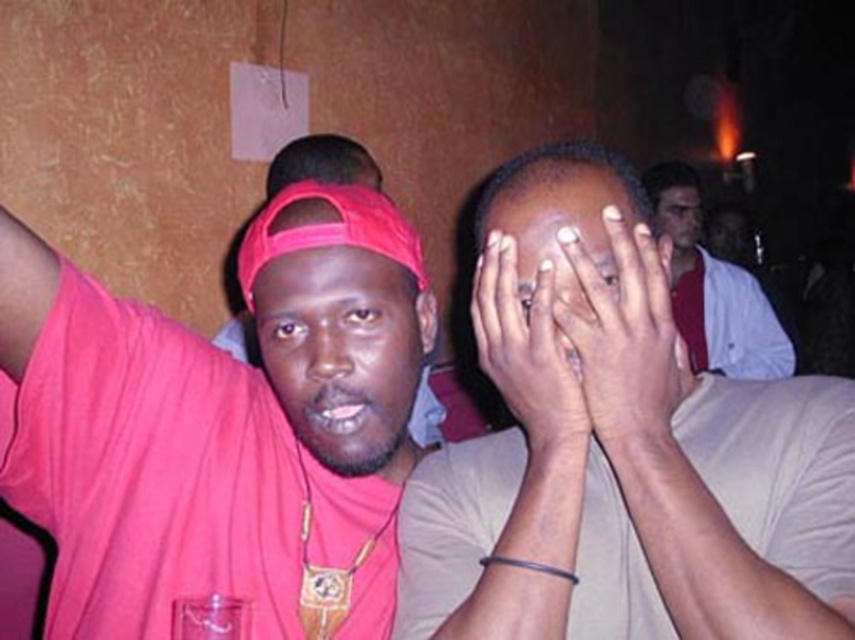
Who is more forward, (567,342) or (669,221)?

Point (567,342)

Is point (570, 422) more distant than point (671, 237)?

No, (570, 422) is closer to viewer.

Between point (555, 420) and point (677, 244), which one is positioned in front?

Point (555, 420) is in front.

You are a GUI agent. You are given a task and a screenshot of the screen. Output one action in this format:
    pyautogui.click(x=<x>, y=<y>)
    Task: Click on the silver metallic ring at center
    This screenshot has height=640, width=855.
    Given the screenshot: What is the action you would take?
    pyautogui.click(x=525, y=348)

Is white matte ring at center wider than smooth skin at center?

Indeed, white matte ring at center has a greater width compared to smooth skin at center.

Who is taller, white matte ring at center or smooth skin at center?

Standing taller between the two is white matte ring at center.

Image resolution: width=855 pixels, height=640 pixels. Find the location of `white matte ring at center`. white matte ring at center is located at coordinates (624, 336).

Who is higher up, smooth skin at center or smooth skin face at center?

smooth skin face at center is above.

Can you confirm if smooth skin at center is positioned to the right of smooth skin face at center?

In fact, smooth skin at center is to the left of smooth skin face at center.

The width and height of the screenshot is (855, 640). Describe the element at coordinates (561, 228) in the screenshot. I see `smooth skin at center` at that location.

I want to click on smooth skin at center, so click(x=561, y=228).